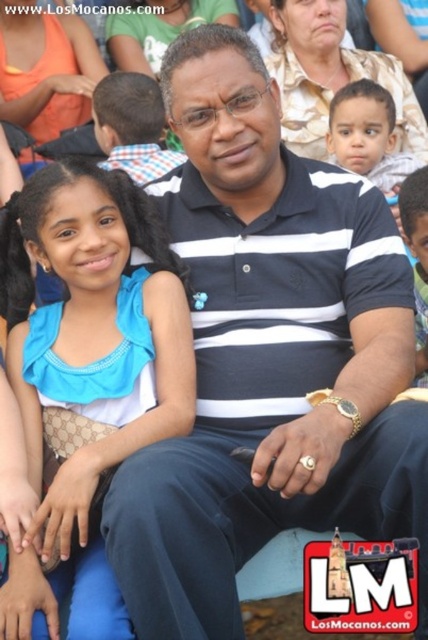
Question: Based on their relative distances, which object is farther from the blue satin dress at left?

Choices:
 (A) smooth skin face at center
 (B) striped cotton polo shirt at center
 (C) smooth skin baby at upper right

Answer: (C)

Question: In this image, where is blue satin dress at left located relative to smooth skin face at center?

Choices:
 (A) right
 (B) left

Answer: (B)

Question: Is the position of striped cotton polo shirt at center less distant than that of smooth skin baby at upper right?

Choices:
 (A) yes
 (B) no

Answer: (A)

Question: Considering the real-world distances, which object is closest to the striped cotton polo shirt at center?

Choices:
 (A) smooth skin face at center
 (B) smooth skin baby at upper right
 (C) blue satin dress at left

Answer: (C)

Question: Is striped cotton polo shirt at center positioned behind smooth skin face at center?

Choices:
 (A) no
 (B) yes

Answer: (A)

Question: Among these points, which one is nearest to the camera?

Choices:
 (A) (256, 285)
 (B) (341, 99)
 (C) (425, 296)

Answer: (A)